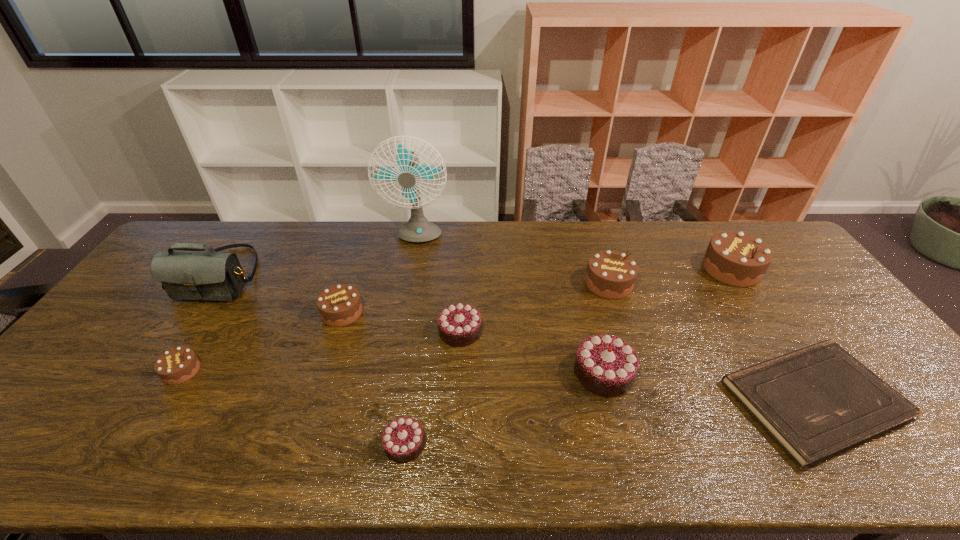
The height and width of the screenshot is (540, 960). In the image, there is a desktop. Identify the location of vacant space at the near edge. (498, 468).

At what (x,y) coordinates should I click in order to perform the action: click on vacant space at the left edge. Please return your answer as a coordinate pair (x, y). The image size is (960, 540). Looking at the image, I should click on tap(91, 343).

Image resolution: width=960 pixels, height=540 pixels. What are the coordinates of `vacant space at the right edge of the desktop` in the screenshot? It's located at [856, 339].

The image size is (960, 540). I want to click on vacant space at the far left corner of the desktop, so click(x=215, y=229).

In the image, there is a desktop. Where is `blank space at the far right corner`? blank space at the far right corner is located at coordinates (777, 243).

Locate an element on the screen. free space that is in between the third brown chocolate cake from left to right and the shortest object is located at coordinates (711, 342).

At what (x,y) coordinates should I click in order to perform the action: click on free point between the second tallest object and the shortest object. Please return your answer as a coordinate pair (x, y). This screenshot has height=540, width=960. Looking at the image, I should click on (517, 338).

The height and width of the screenshot is (540, 960). Find the location of `empty space between the fourth chocolate cake from right to left and the biggest chocolate chocolate cake`. empty space between the fourth chocolate cake from right to left and the biggest chocolate chocolate cake is located at coordinates (532, 352).

I want to click on vacant space in between the sixth shortest chocolate cake and the fan, so click(x=513, y=261).

The width and height of the screenshot is (960, 540). What are the coordinates of `free space between the second chocolate chocolate cake from right to left and the nearest brown chocolate cake` in the screenshot? It's located at pyautogui.click(x=321, y=351).